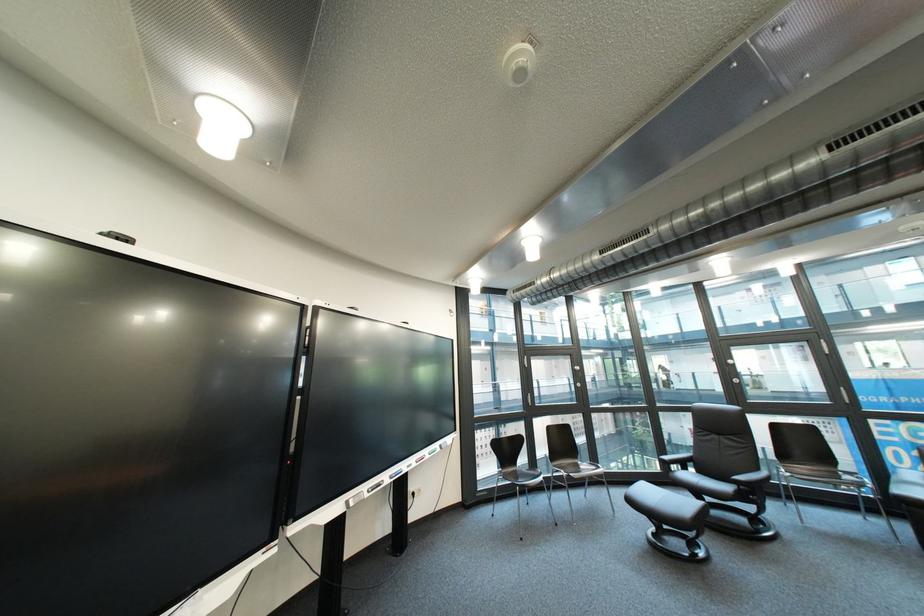
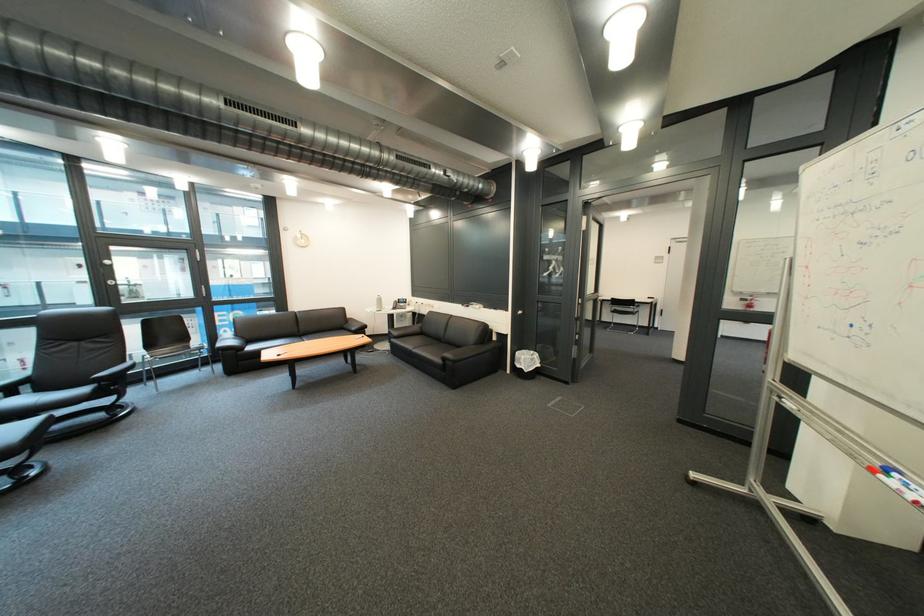
Question: The first image is from the beginning of the video and the second image is from the end. How did the camera likely rotate when shooting the video?

Choices:
 (A) Left
 (B) Right
 (C) Up
 (D) Down

Answer: (B)